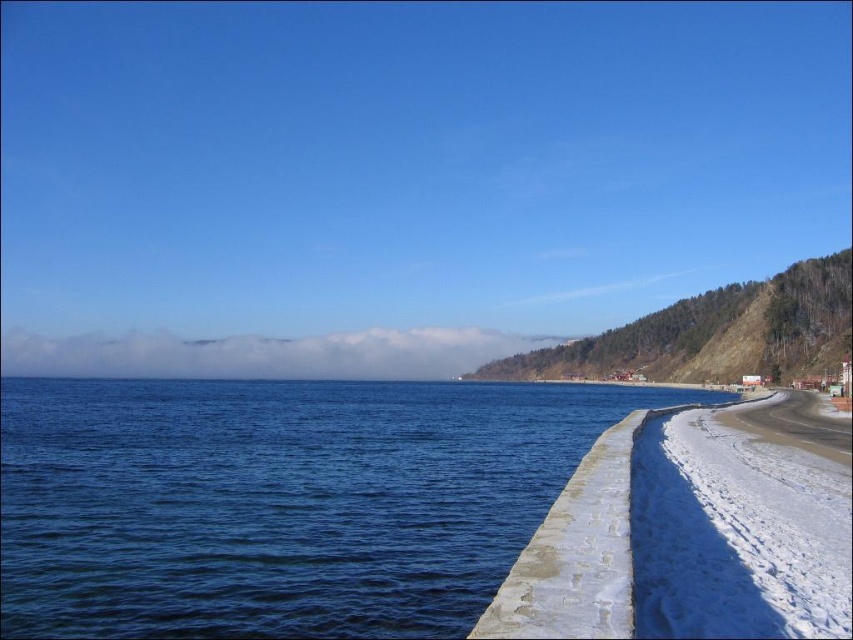
Which of these two, blue water at lower left or white snow at lower right, stands taller?

Standing taller between the two is blue water at lower left.

Can you confirm if blue water at lower left is smaller than white snow at lower right?

Actually, blue water at lower left might be larger than white snow at lower right.

The width and height of the screenshot is (853, 640). What do you see at coordinates (280, 500) in the screenshot?
I see `blue water at lower left` at bounding box center [280, 500].

Where is `blue water at lower left`? The width and height of the screenshot is (853, 640). blue water at lower left is located at coordinates (280, 500).